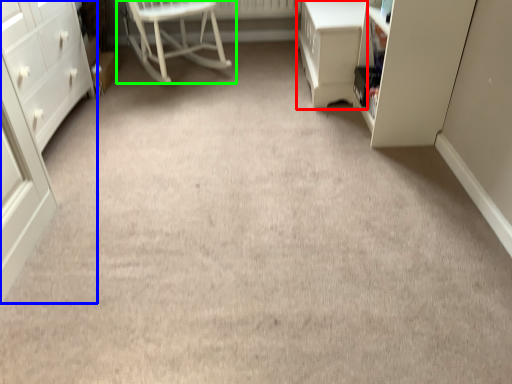
Question: Estimate the real-world distances between objects in this image. Which object is farther from vanity (highlighted by a red box), chest of drawers (highlighted by a blue box) or chair (highlighted by a green box)?

Choices:
 (A) chest of drawers
 (B) chair

Answer: (A)